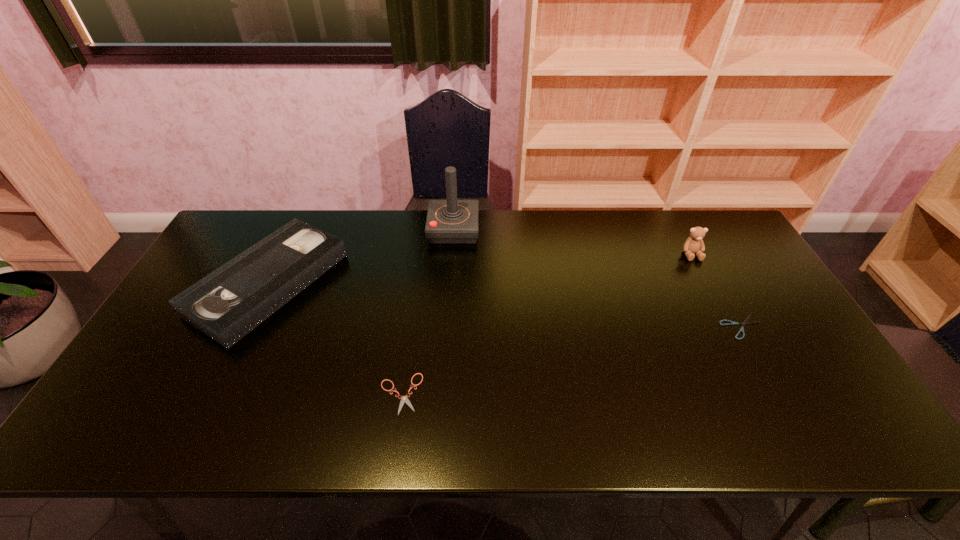
The height and width of the screenshot is (540, 960). What are the coordinates of `vacant region located 0.360m on the left of the nearer shears` in the screenshot? It's located at (228, 394).

The image size is (960, 540). Find the location of `vacant space located 0.270m on the front of the farther shears`. vacant space located 0.270m on the front of the farther shears is located at coordinates (803, 437).

In order to click on joystick present at the far edge in this screenshot , I will do `click(451, 221)`.

In order to click on teddy bear present at the far edge in this screenshot , I will do `click(694, 244)`.

The width and height of the screenshot is (960, 540). What are the coordinates of `videotape located at the far edge` in the screenshot? It's located at (227, 304).

Locate an element on the screen. object that is at the near edge is located at coordinates (404, 399).

This screenshot has height=540, width=960. I want to click on object located in the left edge section of the desktop, so click(x=227, y=304).

You are a GUI agent. You are given a task and a screenshot of the screen. Output one action in this format:
    pyautogui.click(x=<x>, y=<y>)
    Task: Click on the teddy bear that is at the right edge
    The image size is (960, 540).
    Given the screenshot: What is the action you would take?
    pyautogui.click(x=694, y=244)

Where is `shears positioned at the right edge`? The image size is (960, 540). shears positioned at the right edge is located at coordinates (745, 322).

Where is `object that is at the far left corner`? object that is at the far left corner is located at coordinates (227, 304).